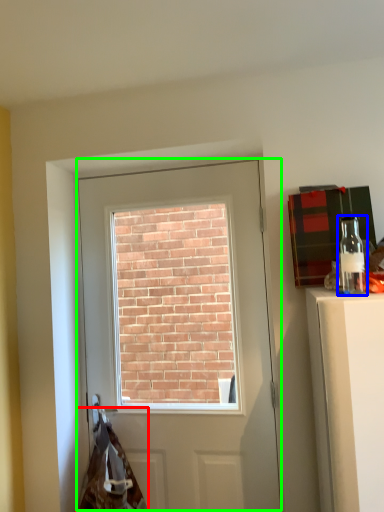
Question: Which object is the closest to the material (highlighted by a red box)? Choose among these: bottle (highlighted by a blue box) or door (highlighted by a green box).

Choices:
 (A) bottle
 (B) door

Answer: (B)